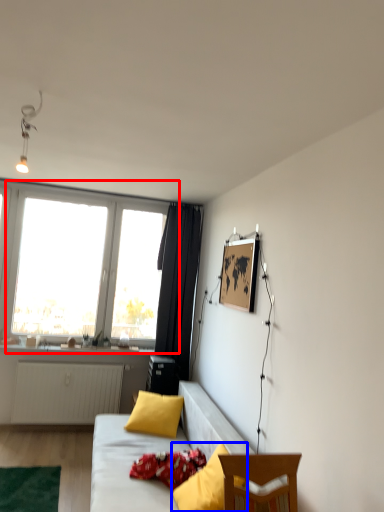
Question: Which of the following is the closest to the observer, window (highlighted by a red box) or pillow (highlighted by a blue box)?

Choices:
 (A) window
 (B) pillow

Answer: (B)